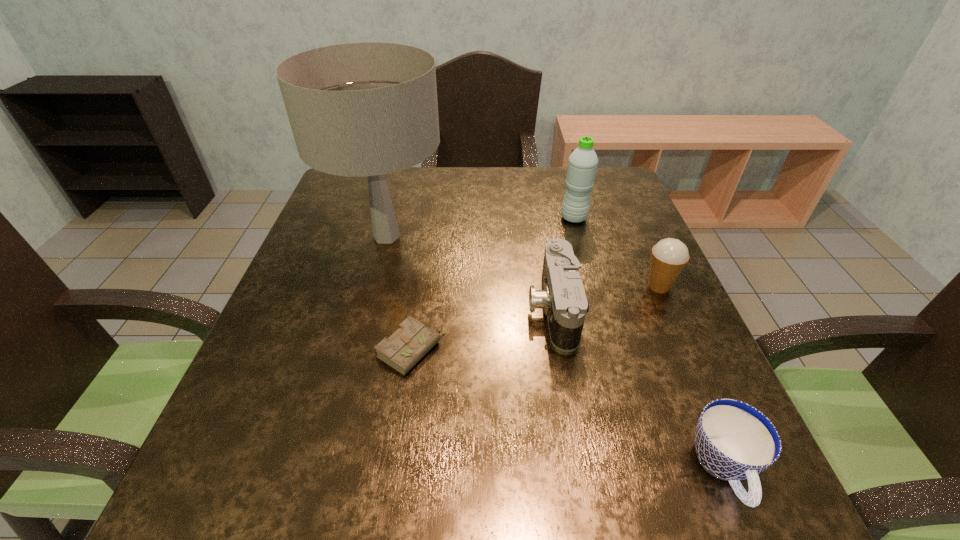
Select which object is the fifth closest to the diary. Please provide its 2D coordinates. Your answer should be formatted as a tuple, i.e. [(x, y)], where the tuple contains the x and y coordinates of a point satisfying the conditions above.

[(582, 165)]

Identify the location of vacant space that satisfies the following two spatial constraints: 1. on the front-facing side of the tallest object; 2. on the back side of the diary. This screenshot has width=960, height=540. (357, 350).

In order to click on vacant position in the image that satisfies the following two spatial constraints: 1. on the back side of the shortest object; 2. on the left side of the second tallest object in this screenshot , I will do `click(430, 218)`.

The height and width of the screenshot is (540, 960). I want to click on free location that satisfies the following two spatial constraints: 1. on the front-facing side of the tallest object; 2. on the back side of the diary, so click(357, 350).

The height and width of the screenshot is (540, 960). In order to click on vacant area in the image that satisfies the following two spatial constraints: 1. on the front side of the icecream; 2. on the lens of the third shortest object in this screenshot , I will do `click(668, 308)`.